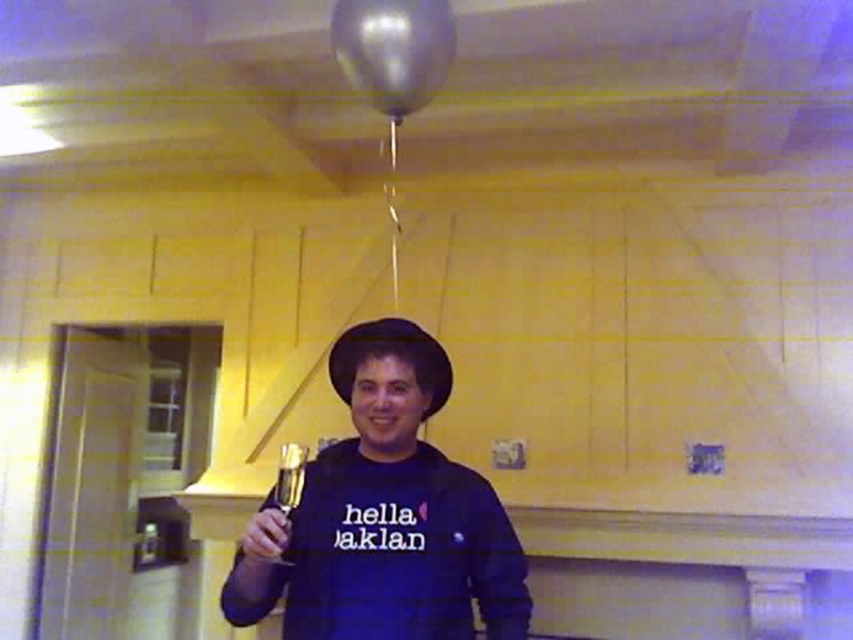
Does matte black hat at center appear over transparent metallic balloon at upper center?

Incorrect, matte black hat at center is not positioned above transparent metallic balloon at upper center.

Which is behind, point (268, 554) or point (428, 1)?

The point (428, 1) is behind.

The image size is (853, 640). What are the coordinates of `matte black hat at center` in the screenshot? It's located at (384, 516).